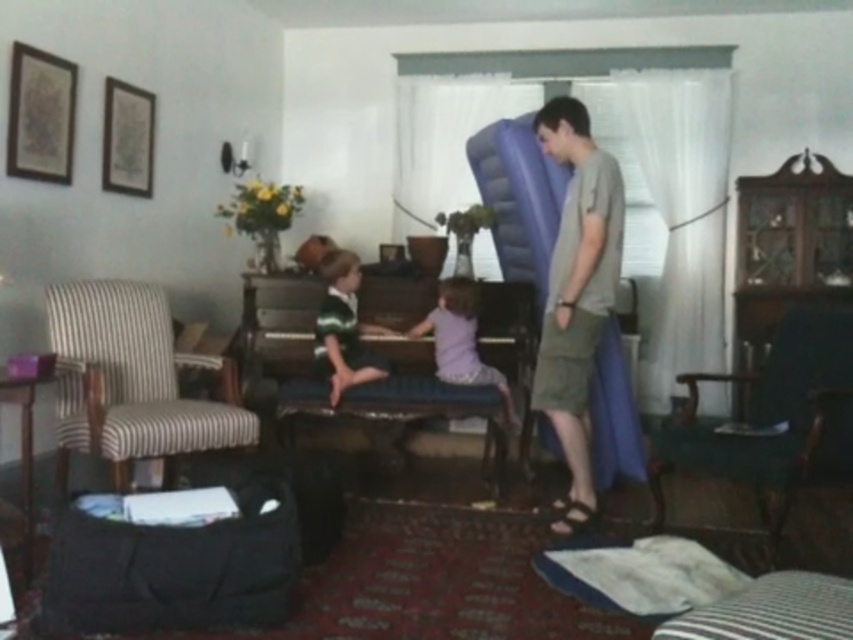
Question: Which object is farther from the camera taking this photo?

Choices:
 (A) dark green fabric armchair at right
 (B) purple cotton shirt at center

Answer: (B)

Question: Among these objects, which one is farthest from the camera?

Choices:
 (A) striped fabric armchair at left
 (B) blue fabric stool at center
 (C) dark green fabric armchair at right
 (D) light gray cotton t-shirt at center

Answer: (B)

Question: Does striped fabric armchair at left have a greater width compared to light gray cotton t-shirt at center?

Choices:
 (A) yes
 (B) no

Answer: (A)

Question: Is light gray cotton t-shirt at center smaller than purple cotton shirt at center?

Choices:
 (A) yes
 (B) no

Answer: (B)

Question: Which point appears closest to the camera in this image?

Choices:
 (A) (502, 492)
 (B) (463, 348)
 (C) (119, 280)

Answer: (C)

Question: In this image, where is dark green fabric armchair at right located relative to light gray cotton t-shirt at center?

Choices:
 (A) right
 (B) left

Answer: (A)